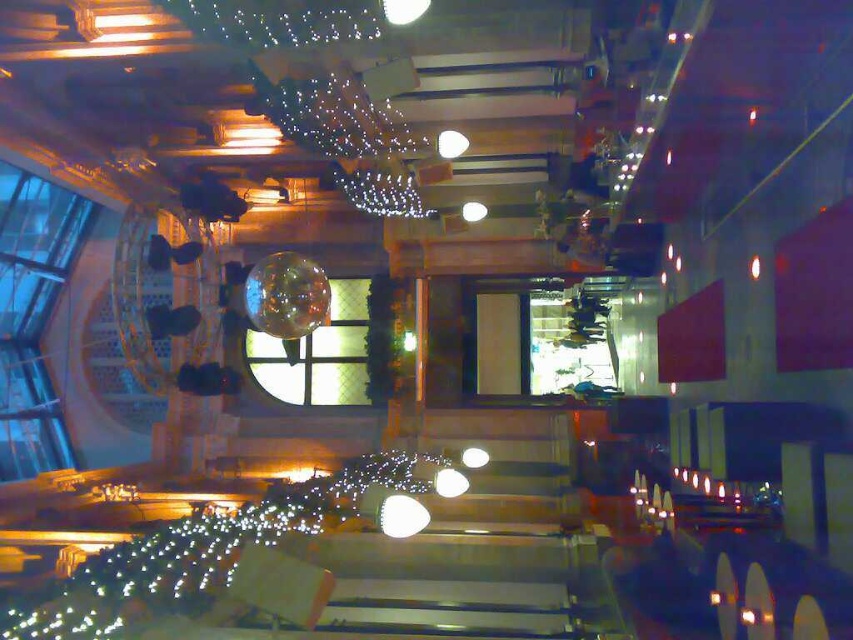
In the scene shown: You are a guest at this venue and want to take a photo through the clear glass window at center. Will the illuminated string lights at center block your view of the outside?

The illuminated string lights at center are in front of the clear glass window at center, so they will block your view when taking a photo through the window.

Looking at this image, you are a maintenance worker in a futuristic restaurant. You need to check the clear glass window at center and the illuminated string lights at center. Given that your ladder can reach up to 5 meters, can you safely reach both objects with your current ladder?

The distance between the illuminated string lights at center and the clear glass window at center is 5.12 meters. Since your ladder can only reach up to 5 meters, you cannot safely reach both objects with your current ladder.